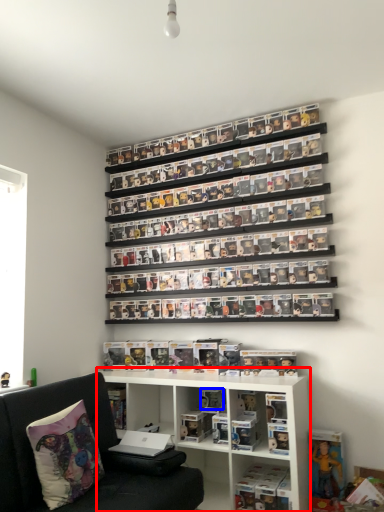
Question: Which object is closer to the camera taking this photo, shelf (highlighted by a red box) or toy (highlighted by a blue box)?

Choices:
 (A) shelf
 (B) toy

Answer: (A)